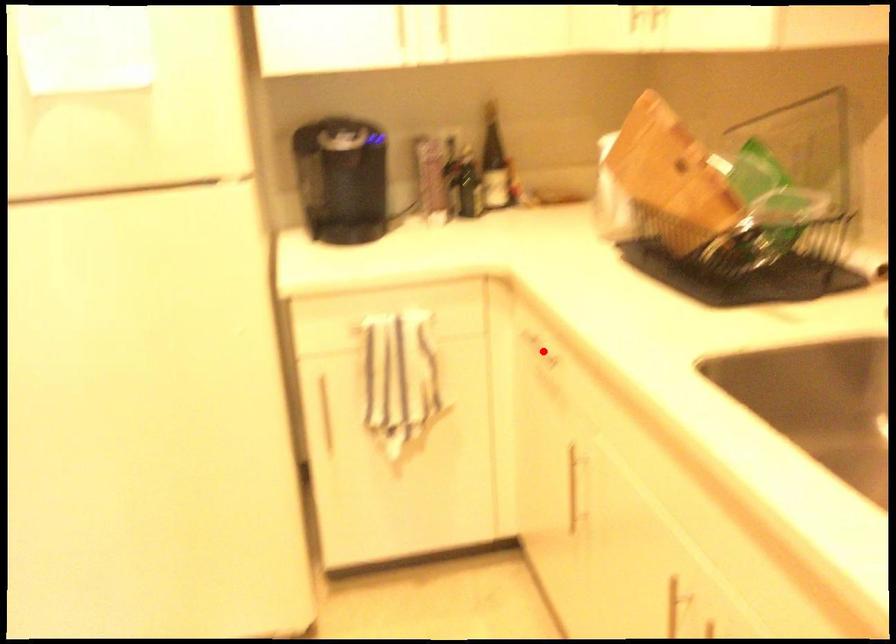
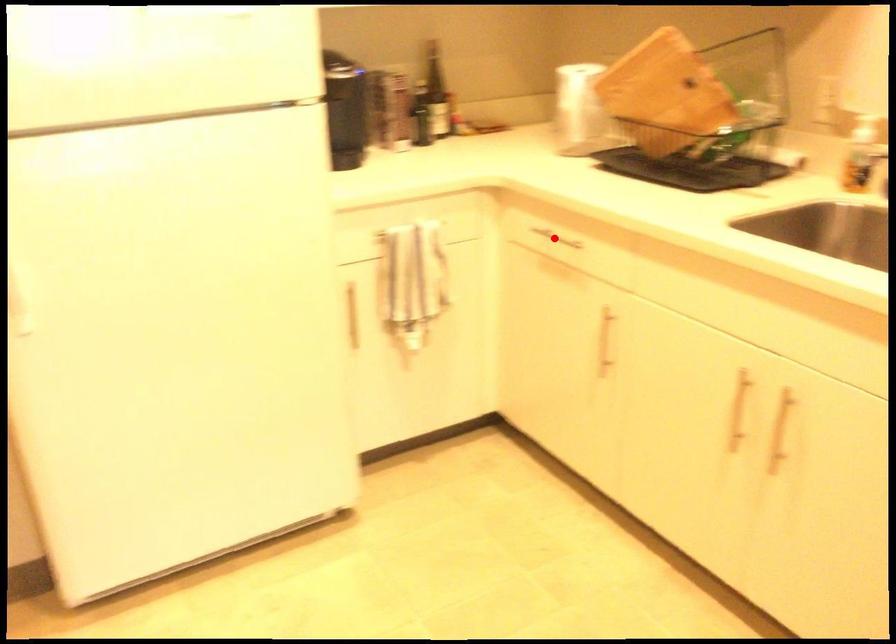
I am providing you with two images of the same scene from different viewpoints. A red point is marked on the first image and another point is marked on the second image. Is the marked point in image1 the same physical position as the marked point in image2?

Yes